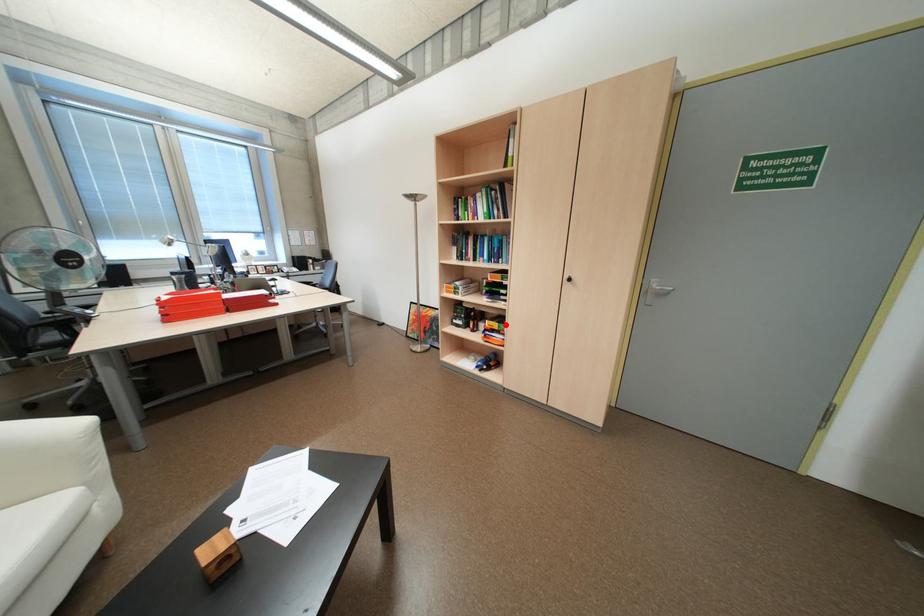
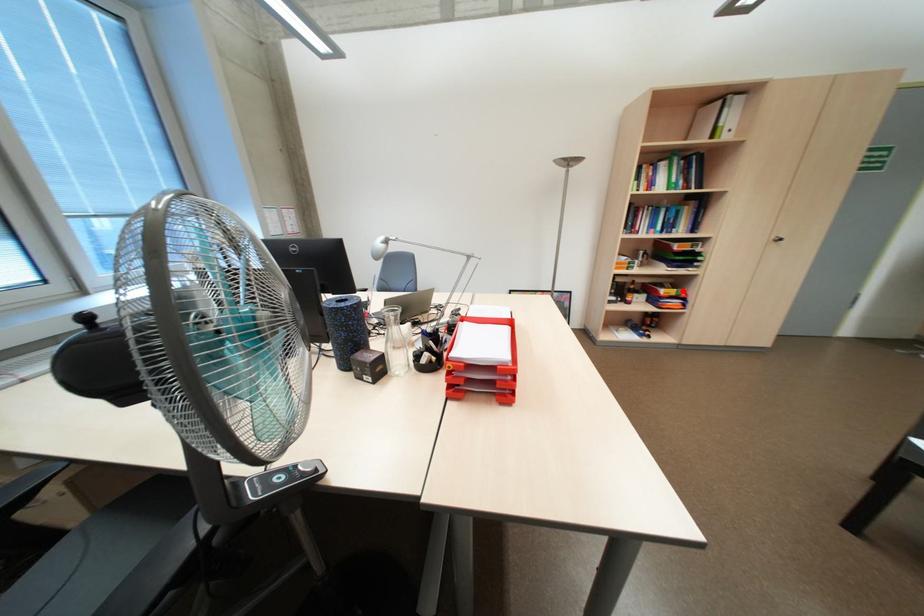
I am providing you with two images of the same scene from different viewpoints. A red point is marked on the first image and another point is marked on the second image. Is the red point in image1 aligned with the point shown in image2?

Yes